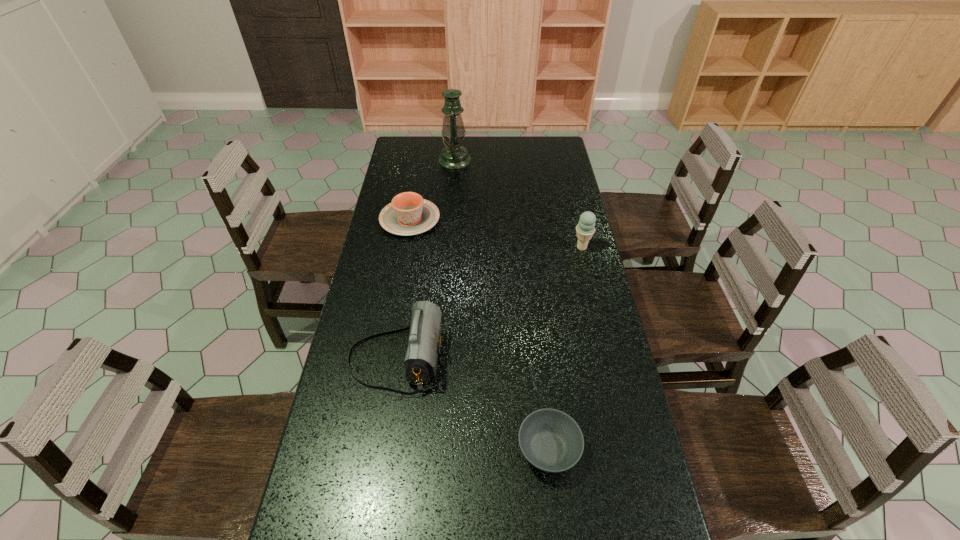
Locate an element on the screen. soup bowl present at the right edge is located at coordinates (550, 440).

The height and width of the screenshot is (540, 960). In the image, there is a desktop. Identify the location of vacant space at the far edge. (438, 161).

I want to click on blank area at the left edge, so click(373, 245).

Image resolution: width=960 pixels, height=540 pixels. I want to click on free region at the right edge of the desktop, so click(x=654, y=530).

At what (x,y) coordinates should I click in order to perform the action: click on unoccupied area between the shoulder bag and the ice cream. Please return your answer as a coordinate pair (x, y). The height and width of the screenshot is (540, 960). Looking at the image, I should click on (489, 303).

The height and width of the screenshot is (540, 960). Find the location of `vacant area between the chinaware and the nearest object`. vacant area between the chinaware and the nearest object is located at coordinates (479, 334).

Find the location of `vacant area between the farthest object and the second nearest object`. vacant area between the farthest object and the second nearest object is located at coordinates (425, 260).

I want to click on free space between the shortest object and the chinaware, so click(x=479, y=334).

Locate an element on the screen. empty location between the shortest object and the second farthest object is located at coordinates (479, 334).

Identify the location of vacant space that is in between the shoulder bag and the fourth nearest object. point(403,289).